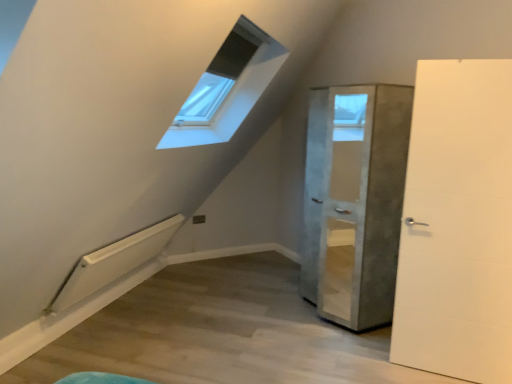
Identify the location of vacant space underneath white matte door at right, marked as the 2th door in a back-to-front arrangement (from a real-world perspective). The width and height of the screenshot is (512, 384). (433, 375).